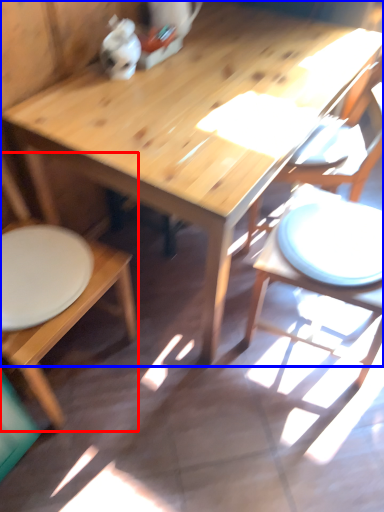
Question: Among these objects, which one is farthest to the camera, chair (highlighted by a red box) or table (highlighted by a blue box)?

Choices:
 (A) chair
 (B) table

Answer: (B)